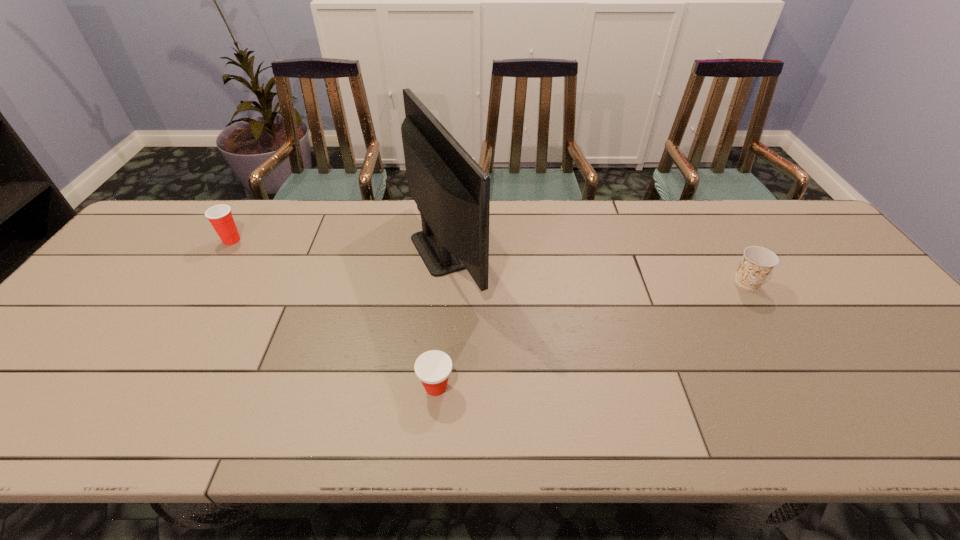
Find the location of `free space located 0.330m on the left of the second Dixie cup from left to right`. free space located 0.330m on the left of the second Dixie cup from left to right is located at coordinates (268, 387).

What are the coordinates of `computer monitor that is at the far edge` in the screenshot? It's located at (452, 192).

Image resolution: width=960 pixels, height=540 pixels. In order to click on Dixie cup present at the far edge in this screenshot , I will do `click(220, 216)`.

At what (x,y) coordinates should I click in order to perform the action: click on vacant area at the far edge of the desktop. Please return your answer as a coordinate pair (x, y). Image resolution: width=960 pixels, height=540 pixels. Looking at the image, I should click on (752, 218).

Find the location of a particular element. The image size is (960, 540). free space at the near edge of the desktop is located at coordinates (690, 408).

Where is `vacant space at the left edge`? This screenshot has height=540, width=960. vacant space at the left edge is located at coordinates (90, 364).

In the image, there is a desktop. Where is `blank space at the right edge`? The height and width of the screenshot is (540, 960). blank space at the right edge is located at coordinates (852, 313).

Locate an element on the screen. free space at the far left corner of the desktop is located at coordinates (154, 244).

Find the location of a particular element. Image resolution: width=960 pixels, height=540 pixels. vacant space at the far right corner of the desktop is located at coordinates (800, 219).

I want to click on unoccupied area between the farthest Dixie cup and the shortest Dixie cup, so click(334, 314).